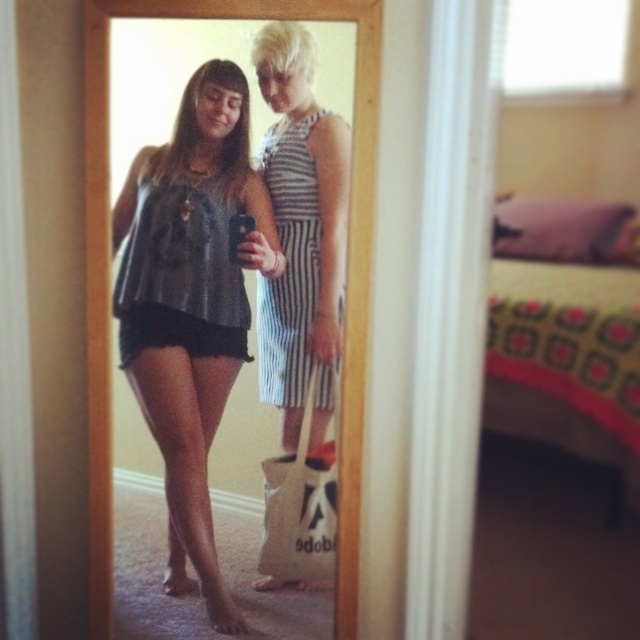
Question: Is matte gray tank top at center further to the viewer compared to striped fabric dress at center?

Choices:
 (A) no
 (B) yes

Answer: (B)

Question: Which point is closer to the camera?

Choices:
 (A) striped fabric dress at center
 (B) matte gray tank top at center

Answer: (A)

Question: From the image, what is the correct spatial relationship of matte gray tank top at center in relation to striped fabric dress at center?

Choices:
 (A) right
 (B) left

Answer: (B)

Question: Which object is closer to the camera taking this photo?

Choices:
 (A) striped fabric dress at center
 (B) matte gray tank top at center

Answer: (A)

Question: Can you confirm if matte gray tank top at center is smaller than striped fabric dress at center?

Choices:
 (A) no
 (B) yes

Answer: (A)